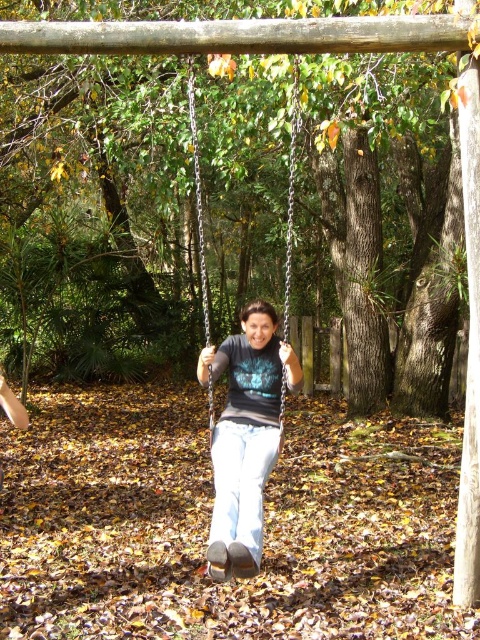
Question: Is matte black shirt at center behind metallic chain swing at center?

Choices:
 (A) yes
 (B) no

Answer: (B)

Question: Does matte black shirt at center appear on the left side of metallic chain swing at center?

Choices:
 (A) yes
 (B) no

Answer: (B)

Question: Which of the following is the farthest from the observer?

Choices:
 (A) matte black shirt at center
 (B) metallic chain swing at center

Answer: (B)

Question: Observing the image, what is the correct spatial positioning of matte black shirt at center in reference to metallic chain swing at center?

Choices:
 (A) above
 (B) below

Answer: (B)